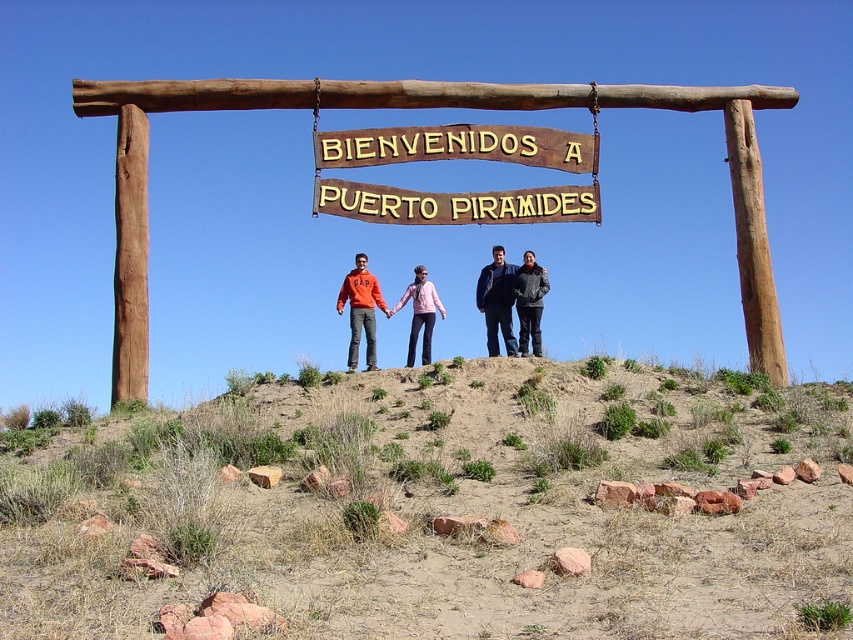
Between dark blue jacket at center and dark gray jacket at center, which one appears on the right side from the viewer's perspective?

From the viewer's perspective, dark gray jacket at center appears more on the right side.

Which is in front, point (515, 352) or point (531, 257)?

Positioned in front is point (515, 352).

The width and height of the screenshot is (853, 640). In order to click on dark blue jacket at center in this screenshot , I will do `click(497, 301)`.

Between dark gray jacket at center and matte pink jacket at center, which one appears on the left side from the viewer's perspective?

Positioned to the left is matte pink jacket at center.

Is point (521, 305) positioned behind point (421, 305)?

No.

Locate an element on the screen. This screenshot has width=853, height=640. dark gray jacket at center is located at coordinates (529, 301).

Locate an element on the screen. dark gray jacket at center is located at coordinates (529, 301).

Does dried grass at center have a greater height compared to dark blue jacket at center?

No.

The height and width of the screenshot is (640, 853). Describe the element at coordinates (437, 509) in the screenshot. I see `dried grass at center` at that location.

In order to click on dried grass at center in this screenshot , I will do `click(437, 509)`.